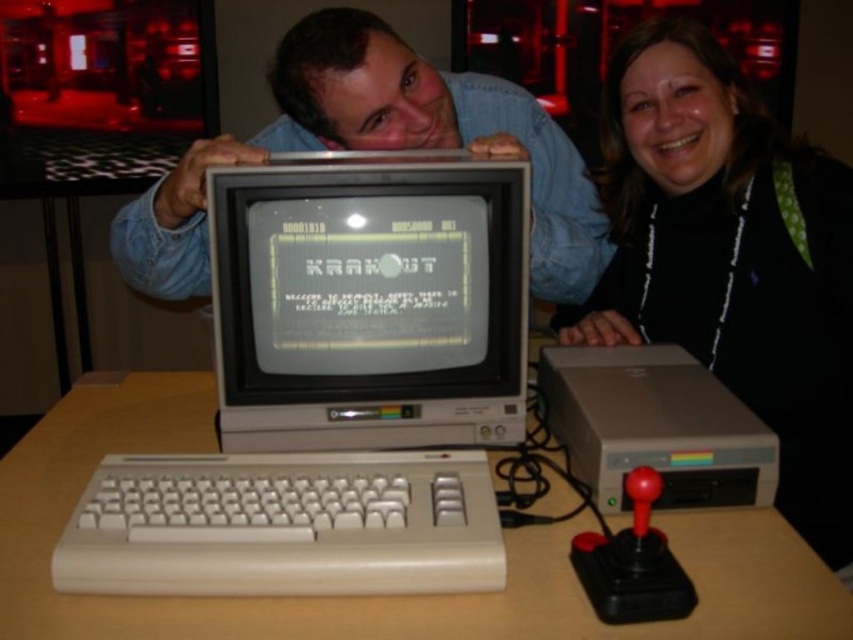
Describe the element at coordinates (730, 259) in the screenshot. I see `black matte jacket at center` at that location.

Is black matte jacket at center below matte gray monitor at center?

Yes.

Does point (740, 280) come farther from viewer compared to point (177, 257)?

Yes, it is behind point (177, 257).

This screenshot has width=853, height=640. In order to click on black matte jacket at center in this screenshot , I will do `click(730, 259)`.

Which is in front, point (809, 340) or point (148, 460)?

Point (148, 460)

Can you confirm if black matte jacket at center is thinner than white plastic keyboard at lower center?

Indeed, black matte jacket at center has a lesser width compared to white plastic keyboard at lower center.

Which is in front, point (618, 298) or point (85, 524)?

Point (85, 524) is in front.

Identify the location of black matte jacket at center. (730, 259).

Is wooden table at center above matte gray monitor at center?

Incorrect, wooden table at center is not positioned above matte gray monitor at center.

Looking at this image, is wooden table at center thinner than matte gray monitor at center?

No, wooden table at center is not thinner than matte gray monitor at center.

Where is `wooden table at center`? The width and height of the screenshot is (853, 640). wooden table at center is located at coordinates (376, 595).